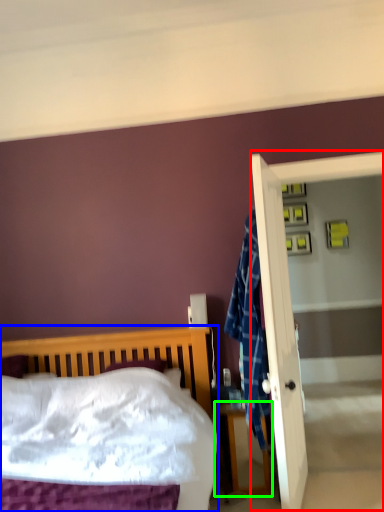
Question: Which is farther away from screen door (highlighted by a red box)? bed (highlighted by a blue box) or nightstand (highlighted by a green box)?

Choices:
 (A) bed
 (B) nightstand

Answer: (A)